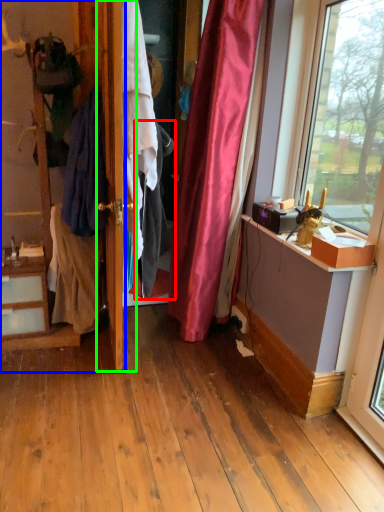
Question: Which object is the farthest from clothing (highlighted by a red box)? Choose among these: dresser (highlighted by a blue box) or door (highlighted by a green box).

Choices:
 (A) dresser
 (B) door

Answer: (A)